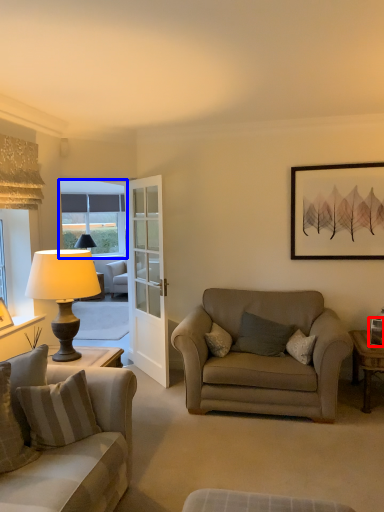
Question: Which point is closer to the camera, picture frame (highlighted by a red box) or window (highlighted by a blue box)?

Choices:
 (A) picture frame
 (B) window

Answer: (A)